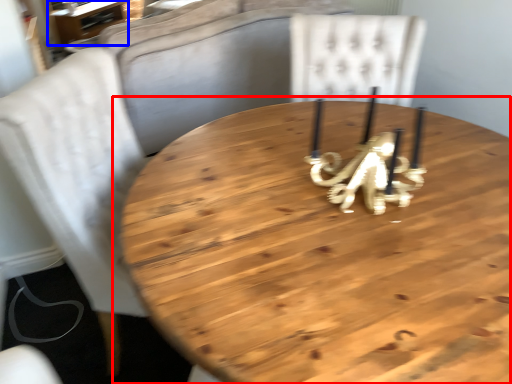
Question: Among these objects, which one is nearest to the camera, table (highlighted by a red box) or table (highlighted by a blue box)?

Choices:
 (A) table
 (B) table

Answer: (A)